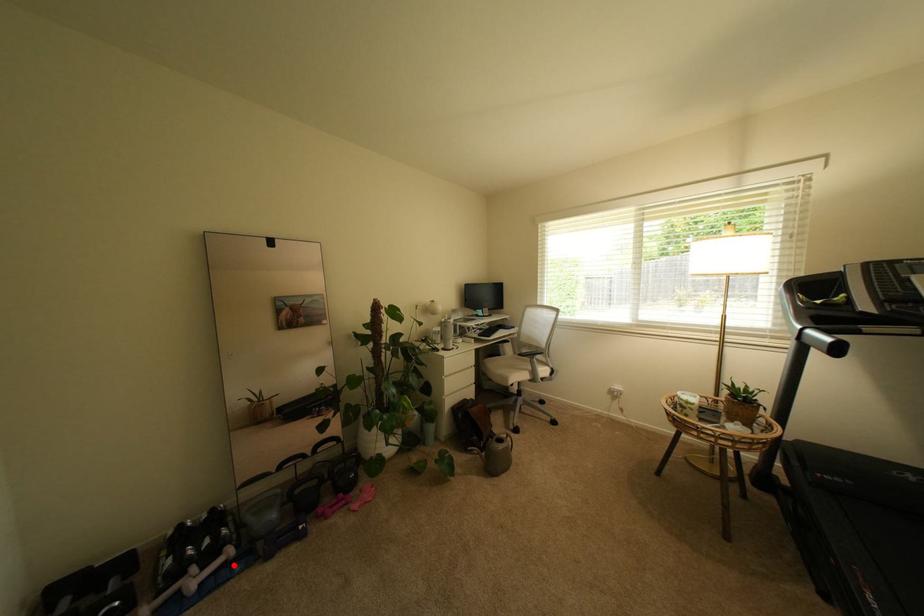
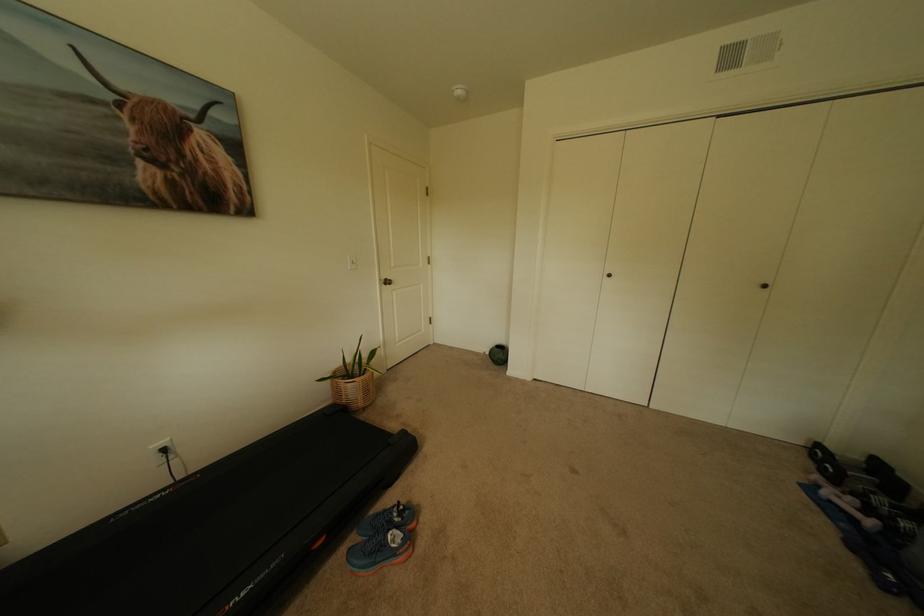
In the second image, find the point that corresponds to the highlighted location in the first image.

(862, 521)